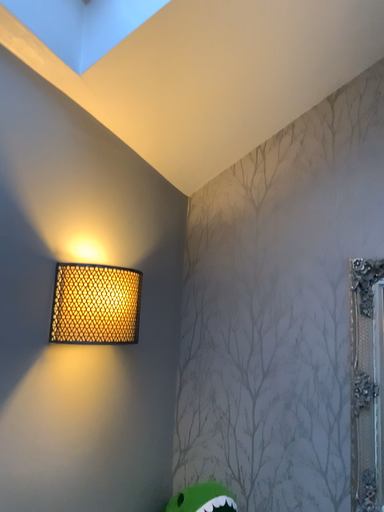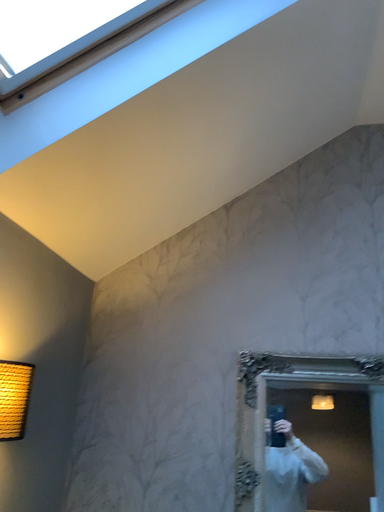
Question: Which way did the camera rotate in the video?

Choices:
 (A) rotated downward
 (B) rotated upward

Answer: (B)